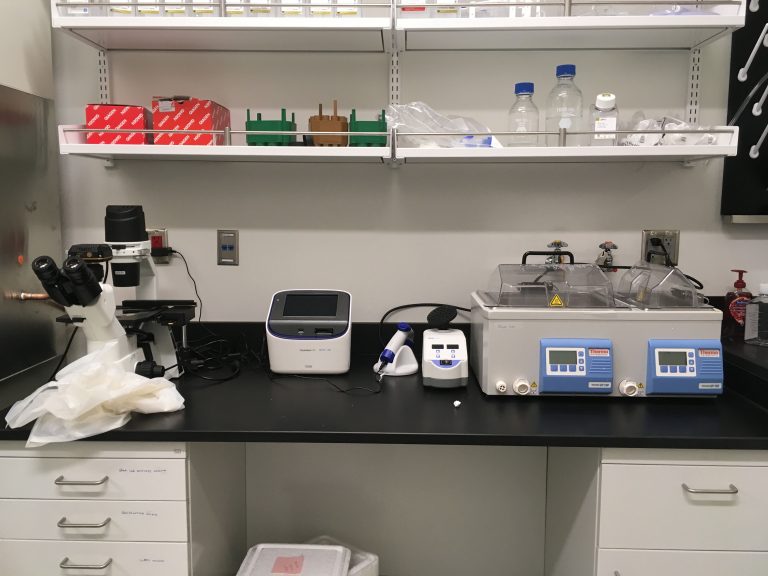
I want to click on panel on wall, so click(x=21, y=164).